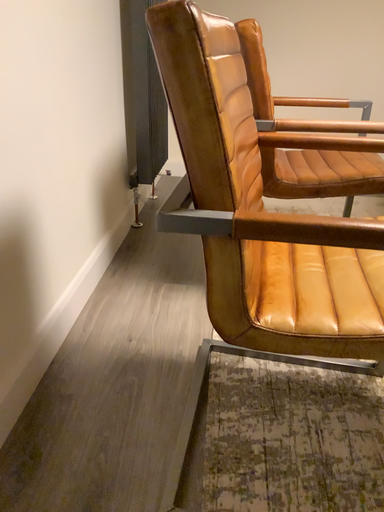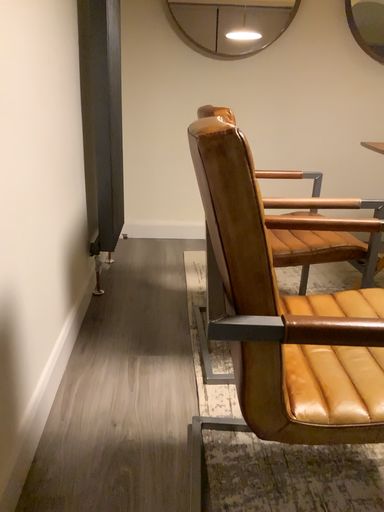
Question: Which way did the camera rotate in the video?

Choices:
 (A) rotated right
 (B) rotated left

Answer: (A)